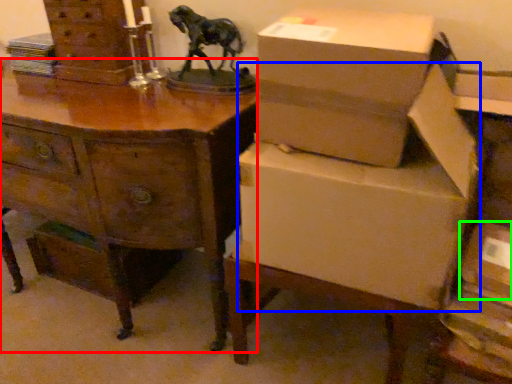
Question: Based on their relative distances, which object is nearer to desk (highlighted by a red box)? Choose from cardboard box (highlighted by a blue box) and storage box (highlighted by a green box).

Choices:
 (A) cardboard box
 (B) storage box

Answer: (A)